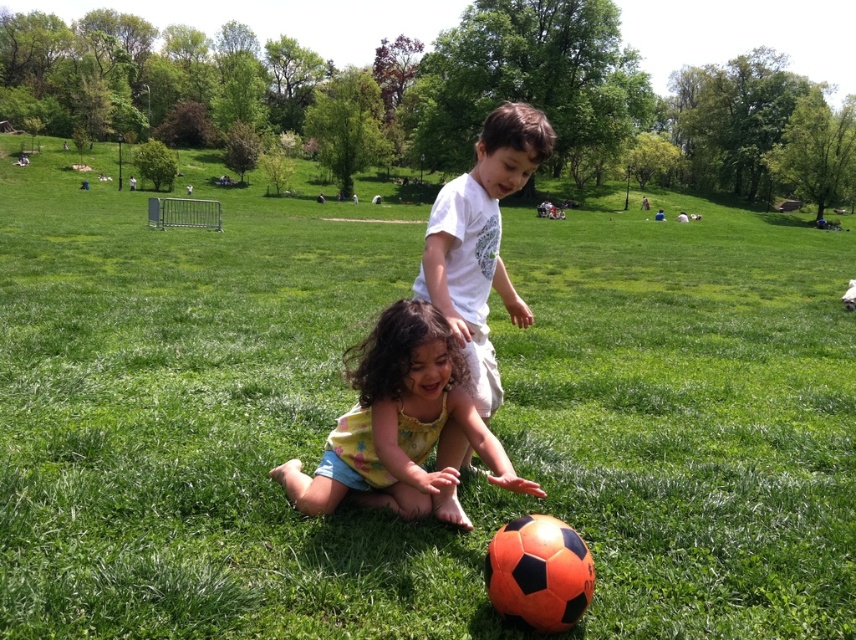
Measure the distance from yellow floral dress at center to white cotton shirt at center.

The distance of yellow floral dress at center from white cotton shirt at center is 17.84 inches.

Is yellow floral dress at center taller than white cotton shirt at center?

No, yellow floral dress at center is not taller than white cotton shirt at center.

What do you see at coordinates (401, 422) in the screenshot? This screenshot has height=640, width=856. I see `yellow floral dress at center` at bounding box center [401, 422].

The width and height of the screenshot is (856, 640). What are the coordinates of `yellow floral dress at center` in the screenshot? It's located at (401, 422).